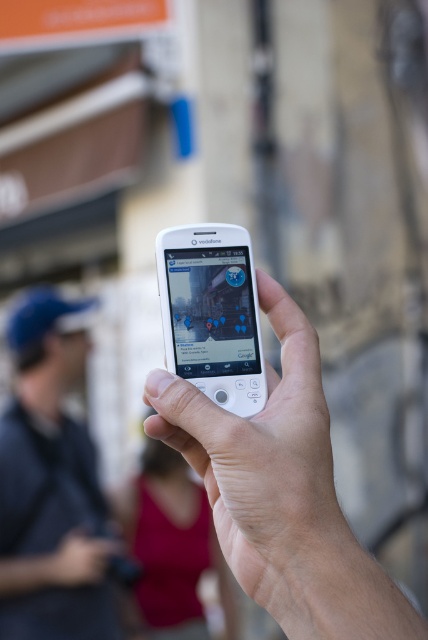
You are trying to decide which item to place in your front pocket. The white matte phone at center and the blue fabric cap at left are both candidates. Given their sizes, which item is more likely to fit comfortably in a typical front pocket?

The white matte phone at center has a smaller size compared to the blue fabric cap at left, so it is more likely to fit comfortably in a typical front pocket.

You are using a Vodafone phone to navigate to a nearby restaurant. The map shows a marker at point (267, 472). Where is this marker located on the phone screen?

The point (267, 472) marks the white matte phone at center, so the marker is located at the center of the phone screen.

You are holding a white matte phone at center and a white matte ipod at center in your hands. Which one do you think is larger in size?

The white matte phone at center is bigger than the white matte ipod at center, so the white matte phone at center is larger in size.